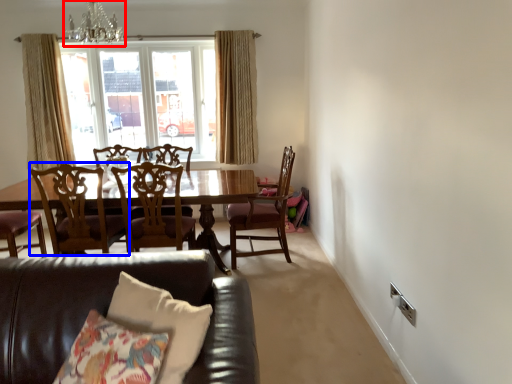
Question: Which object is closer to the camera taking this photo, chandelier (highlighted by a red box) or chair (highlighted by a blue box)?

Choices:
 (A) chandelier
 (B) chair

Answer: (B)